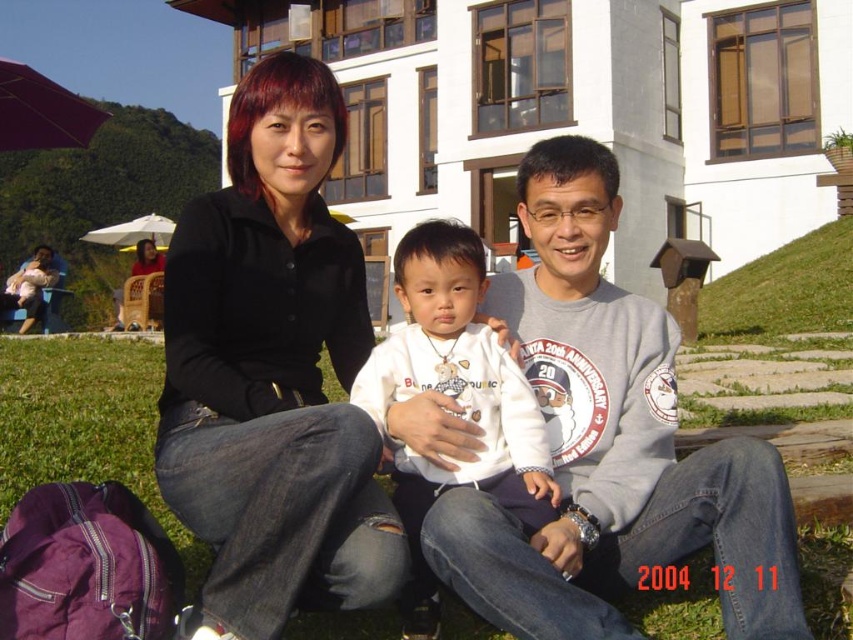
Question: Estimate the real-world distances between objects in this image. Which object is farther from the white fleece jacket at center?

Choices:
 (A) gray cotton sweatshirt at center
 (B) black matte shirt at center

Answer: (B)

Question: Estimate the real-world distances between objects in this image. Which object is closer to the gray cotton sweatshirt at center?

Choices:
 (A) black matte shirt at center
 (B) white fleece jacket at center

Answer: (B)

Question: Where is gray cotton sweatshirt at center located in relation to white fleece jacket at center in the image?

Choices:
 (A) above
 (B) below

Answer: (A)

Question: Where is gray cotton sweatshirt at center located in relation to white fleece jacket at center in the image?

Choices:
 (A) above
 (B) below

Answer: (A)

Question: Which of the following is the farthest from the observer?

Choices:
 (A) white fleece jacket at center
 (B) black matte shirt at center
 (C) gray cotton sweatshirt at center

Answer: (A)

Question: Can you confirm if black matte shirt at center is smaller than gray cotton sweatshirt at center?

Choices:
 (A) no
 (B) yes

Answer: (A)